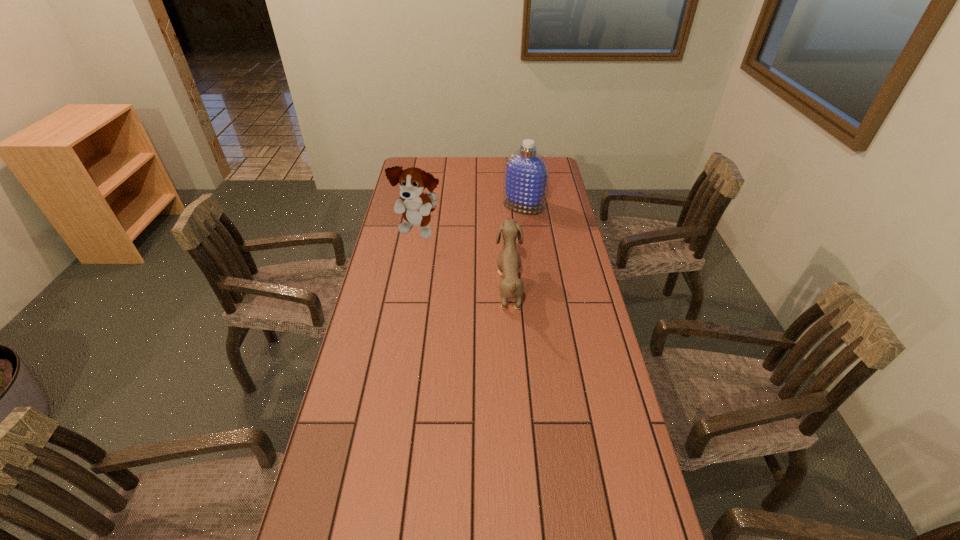
I want to click on object positioned at the left edge, so click(416, 206).

This screenshot has height=540, width=960. Identify the location of object situated at the right edge. (526, 174).

Where is `vacant space at the far edge`? Image resolution: width=960 pixels, height=540 pixels. vacant space at the far edge is located at coordinates (457, 182).

Find the location of a particular element. Image resolution: width=960 pixels, height=540 pixels. free point at the left edge is located at coordinates (310, 521).

You are a GUI agent. You are given a task and a screenshot of the screen. Output one action in this format:
    pyautogui.click(x=<x>, y=<y>)
    Task: Click on the vacant space at the right edge
    
    Given the screenshot: What is the action you would take?
    pyautogui.click(x=559, y=261)

Find the location of a particular element. unoccupied area between the cleansing agent and the shortest object is located at coordinates (516, 246).

The width and height of the screenshot is (960, 540). I want to click on free space between the leftmost object and the farthest object, so click(471, 219).

I want to click on vacant point located between the farther puppy and the farthest object, so click(471, 219).

At what (x,y) coordinates should I click in order to perform the action: click on free space between the nearer puppy and the farthest object. Please return your answer as a coordinate pair (x, y). Looking at the image, I should click on (516, 246).

Find the location of a particular element. This screenshot has height=540, width=960. vacant space in between the leftmost object and the cleansing agent is located at coordinates (471, 219).